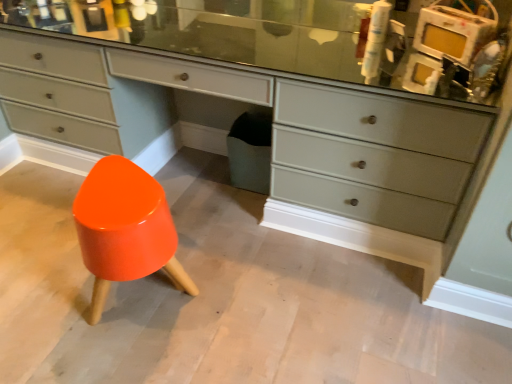
Where is `free space in front of matte gray chest of drawers at center`? This screenshot has width=512, height=384. free space in front of matte gray chest of drawers at center is located at coordinates [x=236, y=294].